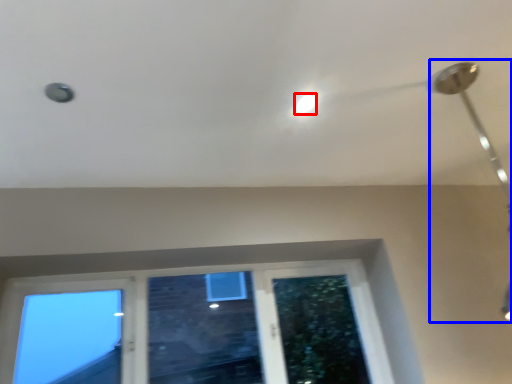
Question: Among these objects, which one is nearest to the camera, droplight (highlighted by a red box) or lamp (highlighted by a blue box)?

Choices:
 (A) droplight
 (B) lamp

Answer: (B)